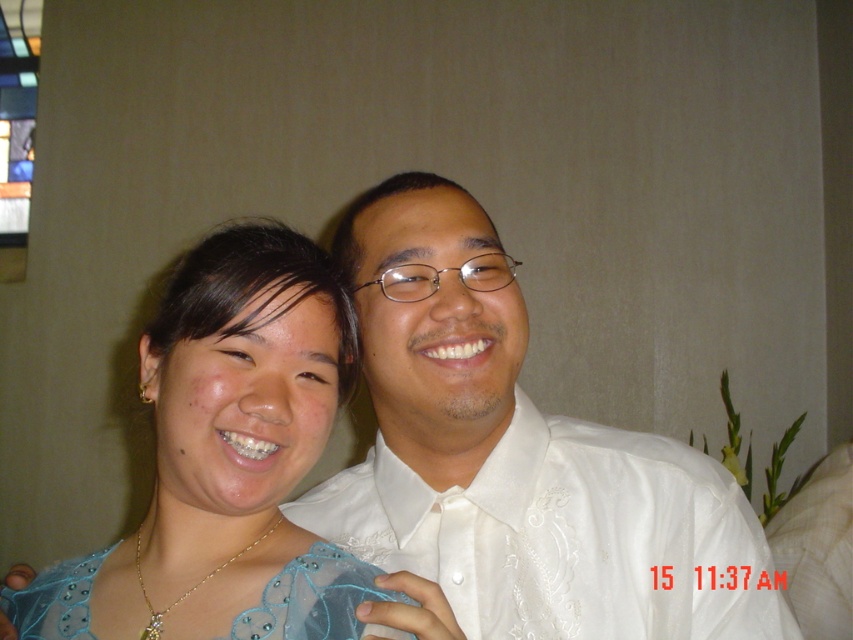
You are a photographer trying to adjust the lighting for a photo shoot. You have two key points to consider for the lighting setup. The first point is at coordinates point (312, 412), and the second is at point (317, 564). Based on their positions, which point should you prioritize for placing a reflector to ensure proper illumination?

Point (312, 412) should be prioritized for placing the reflector because it is in front of point (317, 564), meaning it might be in a shadowed area needing more light.